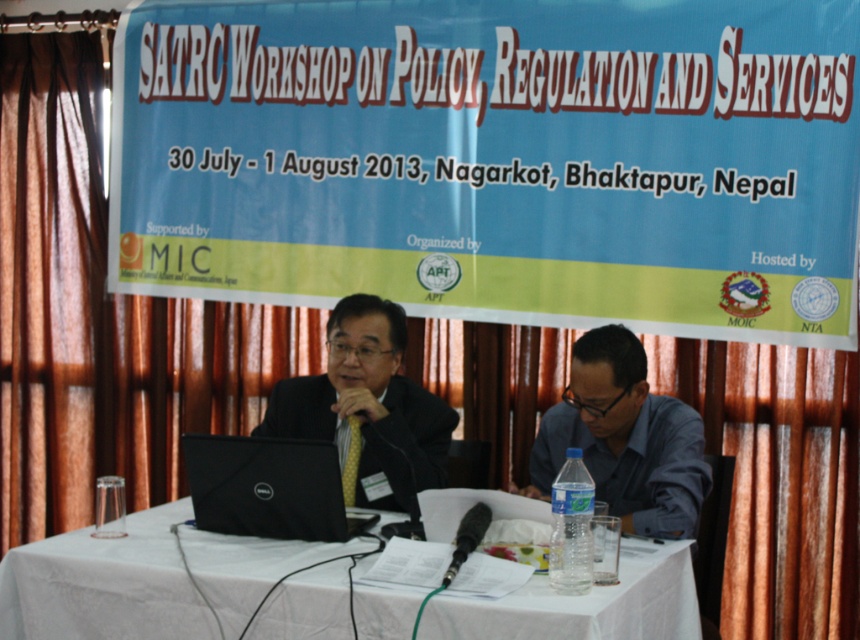
The image size is (860, 640). Find the location of `white cloth-covered table at center`. white cloth-covered table at center is located at coordinates (103, 584).

Locate an element on the screen. white cloth-covered table at center is located at coordinates (103, 584).

Between white cloth-covered table at center and black matte laptop at center, which one has less height?

black matte laptop at center

Between white cloth-covered table at center and black matte laptop at center, which one appears on the left side from the viewer's perspective?

From the viewer's perspective, black matte laptop at center appears more on the left side.

You are a GUI agent. You are given a task and a screenshot of the screen. Output one action in this format:
    pyautogui.click(x=<x>, y=<y>)
    Task: Click on the white cloth-covered table at center
    
    Given the screenshot: What is the action you would take?
    pyautogui.click(x=103, y=584)

Which is in front, point (605, 340) or point (378, 307)?

Positioned in front is point (605, 340).

Can you confirm if blue shirt at center is positioned above black matte suit at center?

No, blue shirt at center is not above black matte suit at center.

Is point (529, 484) less distant than point (351, 413)?

That is True.

In order to click on blue shirt at center in this screenshot , I will do `click(624, 438)`.